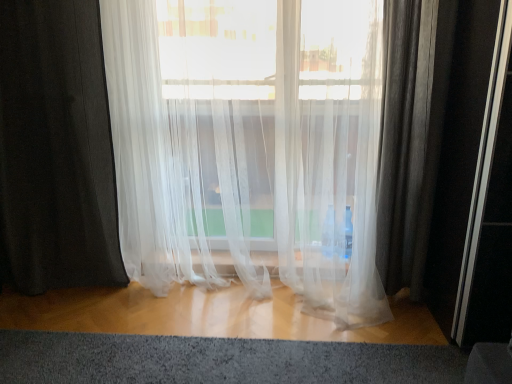
Question: From the image's perspective, is black sheer curtain at left, the 1th curtain viewed from the left, below textured gray carpet at lower center?

Choices:
 (A) no
 (B) yes

Answer: (A)

Question: Can you confirm if black sheer curtain at left, the 1th curtain viewed from the left, is wider than textured gray carpet at lower center?

Choices:
 (A) no
 (B) yes

Answer: (A)

Question: From a real-world perspective, is black sheer curtain at left, the 1th curtain viewed from the left, on textured gray carpet at lower center?

Choices:
 (A) no
 (B) yes

Answer: (B)

Question: Is black sheer curtain at left, the 1th curtain viewed from the left, to the left of textured gray carpet at lower center from the viewer's perspective?

Choices:
 (A) no
 (B) yes

Answer: (B)

Question: Is black sheer curtain at left, the second curtain when ordered from right to left, thinner than textured gray carpet at lower center?

Choices:
 (A) no
 (B) yes

Answer: (B)

Question: Is textured gray carpet at lower center in front of or behind black sheer curtain at left, the 1th curtain viewed from the left, in the image?

Choices:
 (A) behind
 (B) front

Answer: (B)

Question: From the image's perspective, is textured gray carpet at lower center above or below black sheer curtain at left, the second curtain when ordered from right to left?

Choices:
 (A) below
 (B) above

Answer: (A)

Question: Considering the positions of textured gray carpet at lower center and black sheer curtain at left, the second curtain when ordered from right to left, in the image, is textured gray carpet at lower center taller or shorter than black sheer curtain at left, the second curtain when ordered from right to left,?

Choices:
 (A) tall
 (B) short

Answer: (B)

Question: Looking at the image, does textured gray carpet at lower center seem bigger or smaller compared to black sheer curtain at left, the second curtain when ordered from right to left?

Choices:
 (A) small
 (B) big

Answer: (A)

Question: Relative to black sheer curtain at left, the second curtain when ordered from right to left, is translucent white curtain at center, which is the 2th curtain from left to right, in front or behind?

Choices:
 (A) front
 (B) behind

Answer: (A)

Question: From the image's perspective, is translucent white curtain at center, the 1th curtain when ordered from right to left, located above or below black sheer curtain at left, the second curtain when ordered from right to left?

Choices:
 (A) below
 (B) above

Answer: (A)

Question: Is translucent white curtain at center, the 1th curtain when ordered from right to left, to the left or to the right of black sheer curtain at left, the second curtain when ordered from right to left, in the image?

Choices:
 (A) right
 (B) left

Answer: (A)

Question: Looking at their shapes, would you say translucent white curtain at center, which is the 2th curtain from left to right, is wider or thinner than black sheer curtain at left, the second curtain when ordered from right to left?

Choices:
 (A) thin
 (B) wide

Answer: (B)

Question: Considering the positions of black sheer curtain at left, the second curtain when ordered from right to left, and textured gray carpet at lower center in the image, is black sheer curtain at left, the second curtain when ordered from right to left, wider or thinner than textured gray carpet at lower center?

Choices:
 (A) wide
 (B) thin

Answer: (B)

Question: Considering the positions of black sheer curtain at left, the second curtain when ordered from right to left, and textured gray carpet at lower center in the image, is black sheer curtain at left, the second curtain when ordered from right to left, bigger or smaller than textured gray carpet at lower center?

Choices:
 (A) big
 (B) small

Answer: (A)